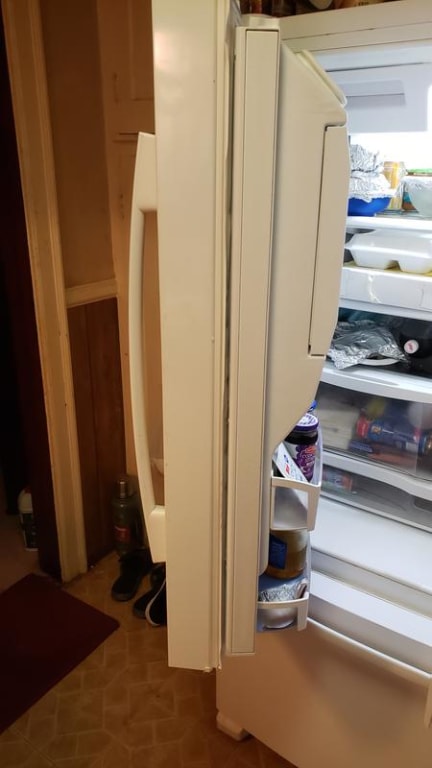
Locate an element on the screen. The width and height of the screenshot is (432, 768). open refrigerator door is located at coordinates (210, 435).